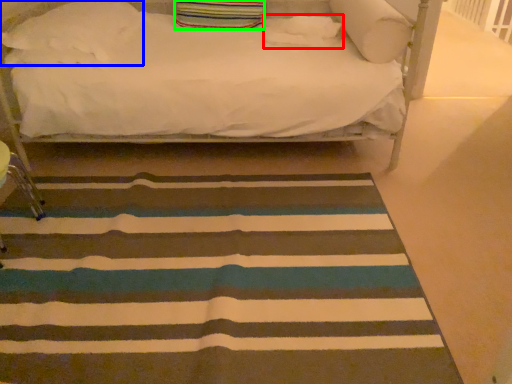
Question: Which object is the closest to the pillow (highlighted by a red box)? Choose among these: pillow (highlighted by a blue box) or pillow (highlighted by a green box).

Choices:
 (A) pillow
 (B) pillow

Answer: (B)